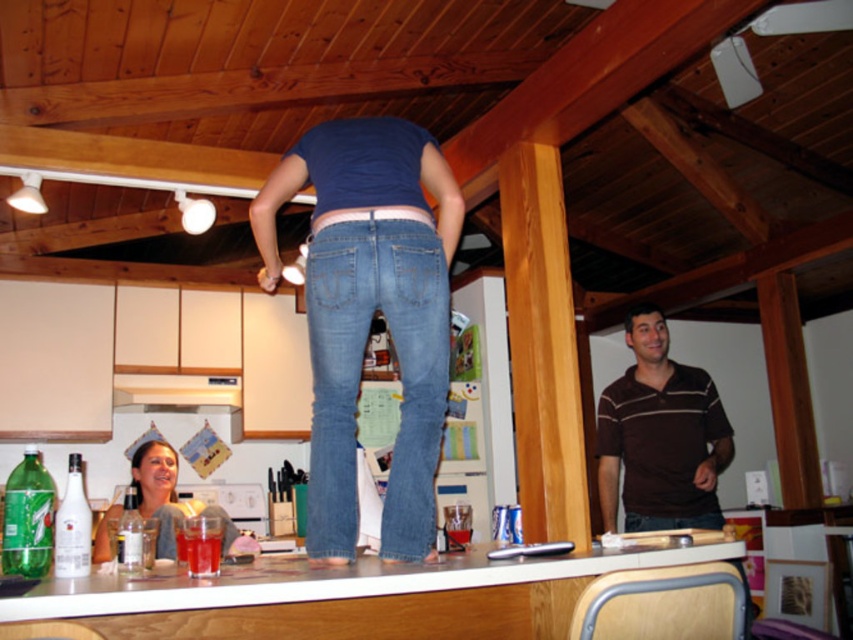
Question: Does white laminate counter at center appear over denim at center?

Choices:
 (A) yes
 (B) no

Answer: (B)

Question: Is the position of denim at center more distant than that of brown striped shirt at right?

Choices:
 (A) no
 (B) yes

Answer: (A)

Question: Which object appears closest to the camera in this image?

Choices:
 (A) white glossy exhaust hood at center
 (B) brown striped shirt at right
 (C) smooth plastic bottle at lower left
 (D) denim at center

Answer: (D)

Question: Which point is closer to the camera taking this photo?

Choices:
 (A) (132, 456)
 (B) (614, 528)
 (C) (181, 376)

Answer: (B)

Question: Does denim at center have a smaller size compared to brown striped shirt at right?

Choices:
 (A) no
 (B) yes

Answer: (B)

Question: Which point is farther to the camera?

Choices:
 (A) (432, 516)
 (B) (227, 381)
 (C) (148, 461)

Answer: (B)